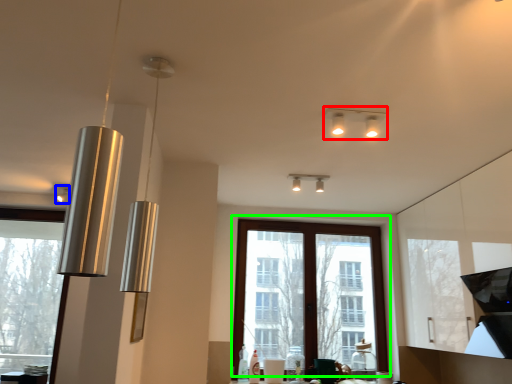
Question: Which is nearer to the lamp (highlighted by a red box)? lamp (highlighted by a blue box) or window (highlighted by a green box).

Choices:
 (A) lamp
 (B) window

Answer: (B)